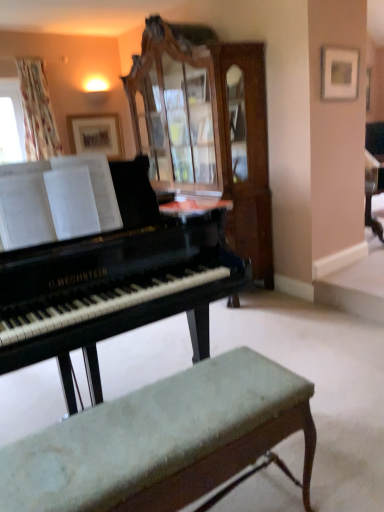
Locate an element on the screen. The height and width of the screenshot is (512, 384). matte wooden picture frame at upper center, marked as the 2th picture frame in a front-to-back arrangement is located at coordinates (96, 134).

In order to face velvet green bench at lower center, should I rotate leftwards or rightwards?

A 2.762 degree turn to the left will do.

Measure the distance between point (301, 418) and camera.

Point (301, 418) and camera are 1.31 meters apart.

Locate an element on the screen. The image size is (384, 512). matte white picture frame at upper right, the 1th picture frame when ordered from front to back is located at coordinates (339, 73).

Can you tell me how much matte white picture frame at upper right, the 2th picture frame from the left, and velvet green bench at lower center differ in facing direction?

The facing directions of matte white picture frame at upper right, the 2th picture frame from the left, and velvet green bench at lower center are 177 degrees apart.

Between point (329, 87) and point (296, 408), which one is positioned in front?

The point (296, 408) is closer to the camera.

Between matte white picture frame at upper right, acting as the 1th picture frame starting from the right, and velvet green bench at lower center, which one has smaller width?

matte white picture frame at upper right, acting as the 1th picture frame starting from the right.

From the image's perspective, would you say matte white picture frame at upper right, the second picture frame from the back, is shown under velvet green bench at lower center?

No, from the image's perspective, matte white picture frame at upper right, the second picture frame from the back, is not beneath velvet green bench at lower center.

I want to click on piano below the wooden cabinet at center (from a real-world perspective), so click(113, 283).

From the image's perspective, which one is positioned lower, black polished piano at center or wooden cabinet at center?

black polished piano at center, from the image's perspective.

Is wooden cabinet at center surrounded by black polished piano at center?

No, wooden cabinet at center is not a part of black polished piano at center.

Can you confirm if black polished piano at center is taller than wooden cabinet at center?

No.

Considering the relative sizes of velvet green bench at lower center and black polished piano at center in the image provided, is velvet green bench at lower center taller than black polished piano at center?

No.

Is velvet green bench at lower center further to the viewer compared to black polished piano at center?

No, it is not.

I want to click on bench on the right of black polished piano at center, so click(x=162, y=440).

Does velvet green bench at lower center appear on the left side of black polished piano at center?

No.

From the image's perspective, which is below, black polished piano at center or orange glossy table at center?

black polished piano at center appears lower in the image.

Is black polished piano at center beside orange glossy table at center?

No, black polished piano at center is not with orange glossy table at center.

At what (x,y) coordinates should I click in order to perform the action: click on table above the black polished piano at center (from a real-world perspective). Please return your answer as a coordinate pair (x, y). This screenshot has width=384, height=512. Looking at the image, I should click on (195, 208).

Which is in front, black polished piano at center or orange glossy table at center?

Positioned in front is black polished piano at center.

Which of these two, orange glossy table at center or velvet green bench at lower center, is bigger?

Bigger between the two is velvet green bench at lower center.

From the image's perspective, is orange glossy table at center over velvet green bench at lower center?

Yes.

Considering the relative sizes of orange glossy table at center and velvet green bench at lower center in the image provided, is orange glossy table at center taller than velvet green bench at lower center?

No.

Considering the relative positions of orange glossy table at center and velvet green bench at lower center in the image provided, is orange glossy table at center in front of velvet green bench at lower center?

No, it is behind velvet green bench at lower center.

Is wooden cabinet at center in front of or behind velvet green bench at lower center in the image?

Clearly, wooden cabinet at center is behind velvet green bench at lower center.

Would you say wooden cabinet at center is inside or outside velvet green bench at lower center?

wooden cabinet at center is spatially situated outside velvet green bench at lower center.

Between wooden cabinet at center and velvet green bench at lower center, which one appears on the left side from the viewer's perspective?

From the viewer's perspective, wooden cabinet at center appears more on the left side.

You are a GUI agent. You are given a task and a screenshot of the screen. Output one action in this format:
    pyautogui.click(x=<x>, y=<y>)
    Task: Click on the piano to the left of matte white picture frame at upper right, the 2th picture frame from the left
    The width and height of the screenshot is (384, 512).
    Given the screenshot: What is the action you would take?
    pyautogui.click(x=113, y=283)

Does matte white picture frame at upper right, acting as the 1th picture frame starting from the right, have a greater height compared to black polished piano at center?

Incorrect, the height of matte white picture frame at upper right, acting as the 1th picture frame starting from the right, is not larger of that of black polished piano at center.

Which object is further away from the camera, matte white picture frame at upper right, the 2th picture frame from the left, or black polished piano at center?

matte white picture frame at upper right, the 2th picture frame from the left, is more distant.

From a real-world perspective, who is located lower, matte white picture frame at upper right, acting as the 1th picture frame starting from the right, or black polished piano at center?

black polished piano at center is physically lower.

From a real-world perspective, which picture frame is the 2nd one above the velvet green bench at lower center? Please provide its 2D coordinates.

[(339, 73)]

Identify the location of piano located underneath the wooden cabinet at center (from a real-world perspective). (113, 283).

Which object lies further to the anchor point orange glossy table at center, wooden cabinet at center or matte white picture frame at upper right, the 1th picture frame when ordered from front to back?

Based on the image, matte white picture frame at upper right, the 1th picture frame when ordered from front to back, appears to be further to orange glossy table at center.

Which object lies nearer to the anchor point matte white picture frame at upper right, the 1th picture frame when ordered from front to back, wooden cabinet at center or orange glossy table at center?

The object closer to matte white picture frame at upper right, the 1th picture frame when ordered from front to back, is wooden cabinet at center.

Based on their spatial positions, is black polished piano at center or wooden cabinet at center closer to velvet green bench at lower center?

black polished piano at center.

Looking at the image, which one is located further to velvet green bench at lower center, matte wooden picture frame at upper center, placed as the first picture frame when sorted from left to right, or matte white picture frame at upper right, acting as the 1th picture frame starting from the right?

matte wooden picture frame at upper center, placed as the first picture frame when sorted from left to right.

When comparing their distances from velvet green bench at lower center, does matte white picture frame at upper right, the second picture frame from the back, or black polished piano at center seem closer?

black polished piano at center.

When comparing their distances from wooden cabinet at center, does velvet green bench at lower center or matte wooden picture frame at upper center, which is the 1th picture frame from back to front, seem further?

velvet green bench at lower center lies further to wooden cabinet at center than the other object.

Which object lies further to the anchor point black polished piano at center, matte wooden picture frame at upper center, placed as the first picture frame when sorted from left to right, or velvet green bench at lower center?

Based on the image, matte wooden picture frame at upper center, placed as the first picture frame when sorted from left to right, appears to be further to black polished piano at center.

Looking at the image, which one is located further to matte wooden picture frame at upper center, marked as the 2th picture frame in a front-to-back arrangement, matte white picture frame at upper right, the 1th picture frame when ordered from front to back, or orange glossy table at center?

matte white picture frame at upper right, the 1th picture frame when ordered from front to back, is further to matte wooden picture frame at upper center, marked as the 2th picture frame in a front-to-back arrangement.

Image resolution: width=384 pixels, height=512 pixels. In order to click on table between matte white picture frame at upper right, the 1th picture frame when ordered from front to back, and velvet green bench at lower center in the up-down direction in this screenshot , I will do `click(195, 208)`.

At what (x,y) coordinates should I click in order to perform the action: click on piano positioned between velvet green bench at lower center and orange glossy table at center from near to far. Please return your answer as a coordinate pair (x, y). Looking at the image, I should click on (113, 283).

This screenshot has width=384, height=512. In order to click on picture frame between black polished piano at center and matte wooden picture frame at upper center, placed as the first picture frame when sorted from left to right, from front to back in this screenshot , I will do `click(339, 73)`.

Identify the location of table between wooden cabinet at center and matte white picture frame at upper right, the second picture frame from the back, from left to right. (195, 208).